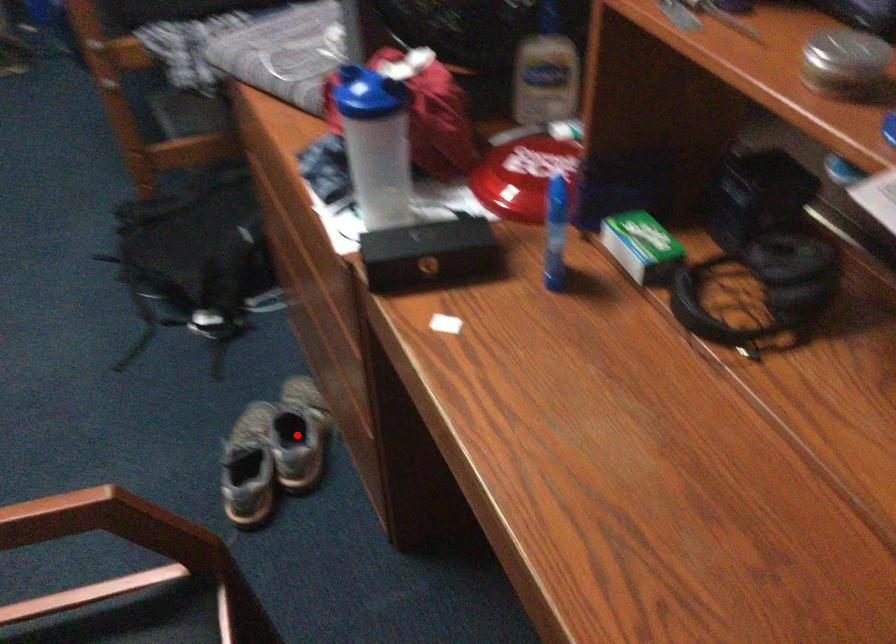
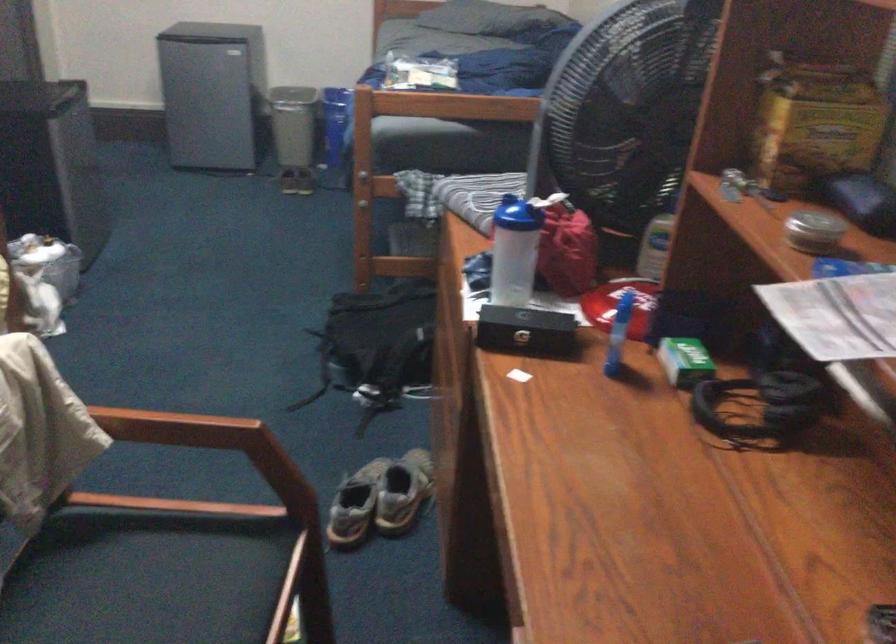
Question: I am providing you with two images of the same scene from different viewpoints. A red point is marked on the first image. At the location where the point appears in image 1, is it still visible in image 2?

Choices:
 (A) Yes
 (B) No

Answer: (A)